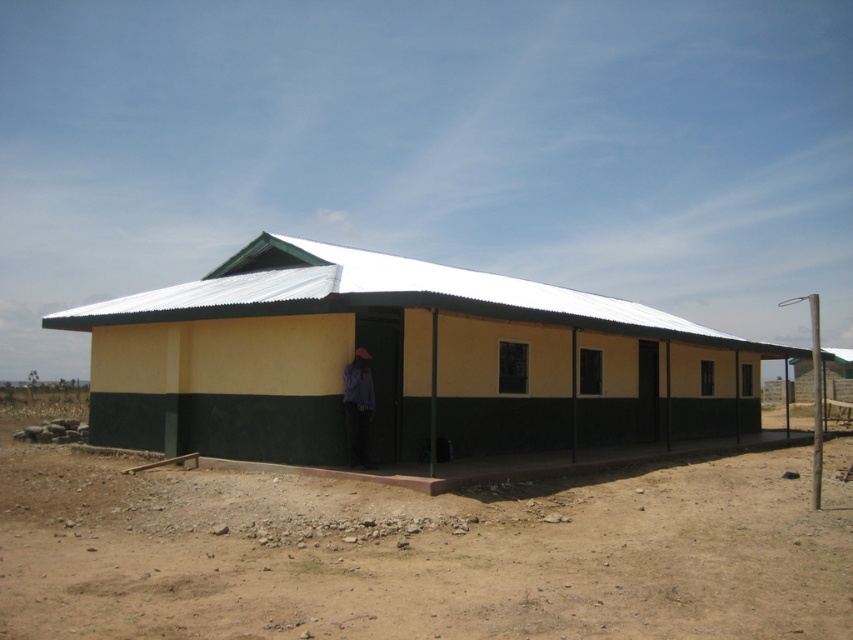
Question: Is brown sandy dirt at lower center to the right of yellow matte building at center from the viewer's perspective?

Choices:
 (A) no
 (B) yes

Answer: (B)

Question: Is brown sandy dirt at lower center closer to camera compared to yellow matte building at center?

Choices:
 (A) yes
 (B) no

Answer: (A)

Question: Which point appears farthest from the camera in this image?

Choices:
 (A) (300, 288)
 (B) (635, 483)

Answer: (A)

Question: In this image, where is brown sandy dirt at lower center located relative to yellow matte building at center?

Choices:
 (A) left
 (B) right

Answer: (B)

Question: Which point appears farthest from the camera in this image?

Choices:
 (A) (407, 588)
 (B) (376, 388)

Answer: (B)